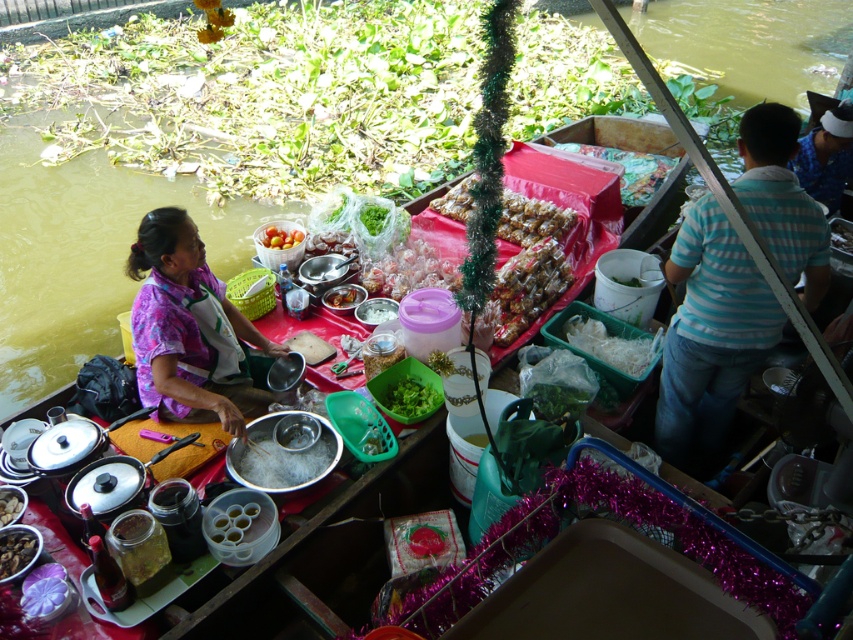
Question: From the image, what is the correct spatial relationship of purple floral shirt at center in relation to translucent plastic container at center?

Choices:
 (A) right
 (B) left

Answer: (B)

Question: Which of these objects is positioned closest to the shiny plastic container at center?

Choices:
 (A) smooth brown nuts at center
 (B) shiny golden candy at center
 (C) blue striped shirt at right
 (D) translucent plastic wrapped candies at center

Answer: (D)

Question: Which object is farther from the camera taking this photo?

Choices:
 (A) purple floral shirt at center
 (B) translucent plastic container at center

Answer: (B)

Question: Estimate the real-world distances between objects in this image. Which object is farther from the blue striped shirt at right?

Choices:
 (A) shiny silver bowl at center
 (B) purple floral shirt at center
 (C) green leafy vegetable at center
 (D) translucent plastic candy at center

Answer: (B)

Question: Does purple floral shirt at center appear on the right side of green leafy vegetable at center?

Choices:
 (A) yes
 (B) no

Answer: (B)

Question: Where is translucent plastic container at center located in relation to smooth brown nuts at center in the image?

Choices:
 (A) above
 (B) below

Answer: (A)